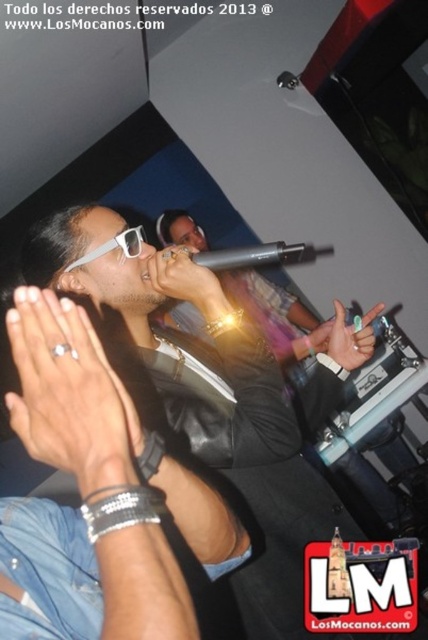
You are a photographer at the concert and want to capture a closeup of the silver metallic ring at center. Based on its position, where should you aim your camera relative to the performer?

The silver metallic ring at center is located at coordinates approximately 0.606 on the x axis and 0.150 on the y axis, so you should aim your camera slightly to the right and lower down relative to the performer to capture it in focus.

You are a photographer at the concert. You want to capture a closeup shot of the silver metallic ring at center without including the camera in the frame. Is the distance between them sufficient for you to zoom in on the ring while keeping the camera out of the shot?

The silver metallic ring at center and camera are 17.62 inches apart from each other. Since the distance is relatively close, zooming in on the ring might inadvertently include the camera in the frame unless adjusted carefully. However, with precise framing, it could be possible to isolate the ring while excluding the camera.

You are a stagehand preparing to place two rings on a small circular platform that can only accommodate one ring at a time. You have the silver metallic ring at center and the green matte ring at center. Based on their sizes, which ring should you place first to ensure it fits properly?

The silver metallic ring at center has a larger width than the green matte ring at center. Therefore, you should place the silver metallic ring at center first to ensure it fits on the platform before the smaller one.